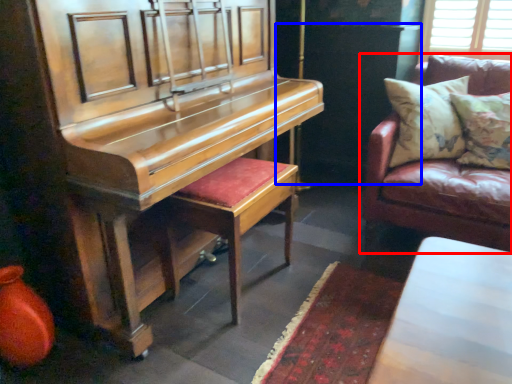
Question: Which object appears farthest to the camera in this image, studio couch (highlighted by a red box) or dark (highlighted by a blue box)?

Choices:
 (A) studio couch
 (B) dark

Answer: (B)